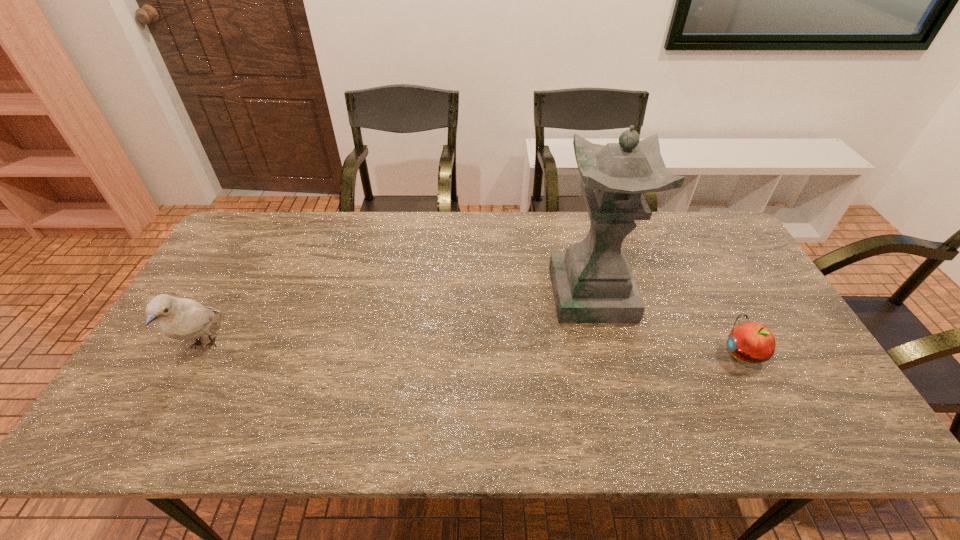
Find the location of a particular element. The height and width of the screenshot is (540, 960). free space that satisfies the following two spatial constraints: 1. at the front opening of the shortest object; 2. on the right side of the second object from left to right is located at coordinates (607, 354).